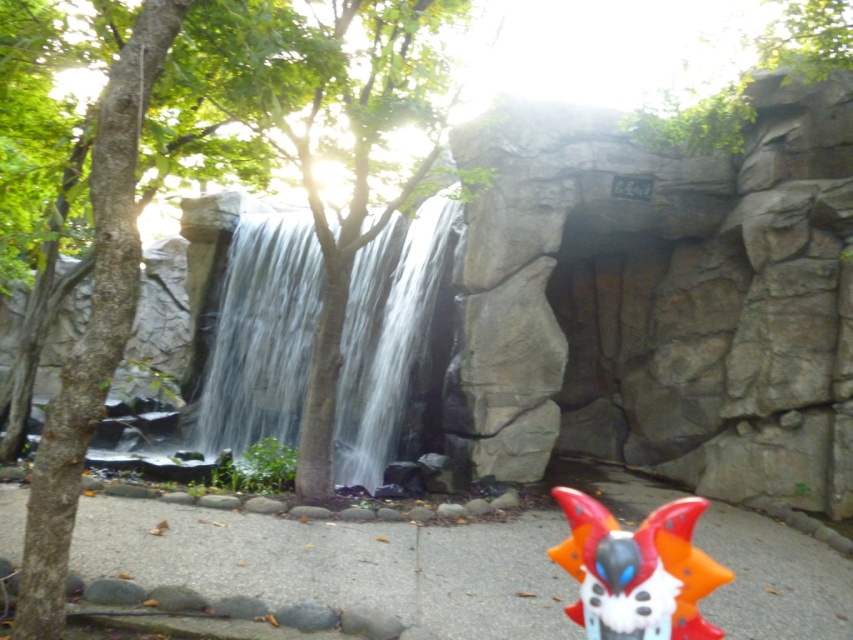
Question: Does clear water at center have a smaller size compared to orange plastic mask at lower right?

Choices:
 (A) no
 (B) yes

Answer: (A)

Question: Among these points, which one is farthest from the camera?

Choices:
 (A) (236, 396)
 (B) (631, 572)

Answer: (A)

Question: Where is clear water at center located in relation to orange plastic mask at lower right in the image?

Choices:
 (A) right
 (B) left

Answer: (B)

Question: Can you confirm if clear water at center is positioned above orange plastic mask at lower right?

Choices:
 (A) yes
 (B) no

Answer: (A)

Question: Which object appears closest to the camera in this image?

Choices:
 (A) orange plastic mask at lower right
 (B) clear water at center

Answer: (A)